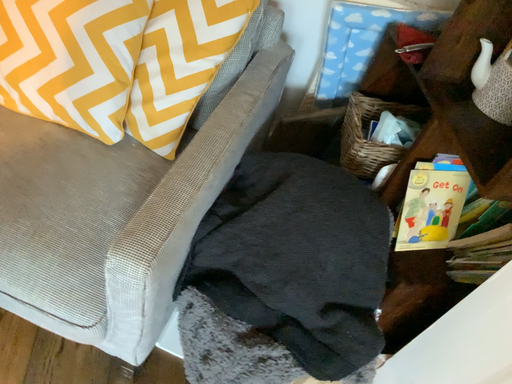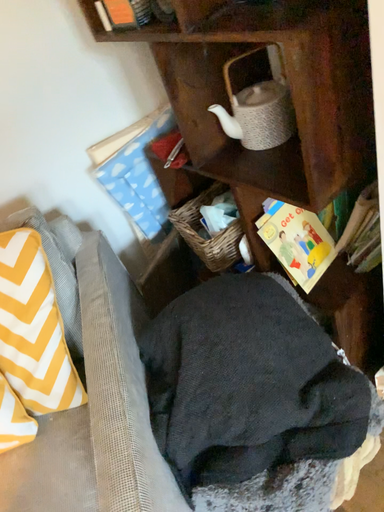
Question: Which way did the camera rotate in the video?

Choices:
 (A) rotated downward
 (B) rotated upward

Answer: (B)